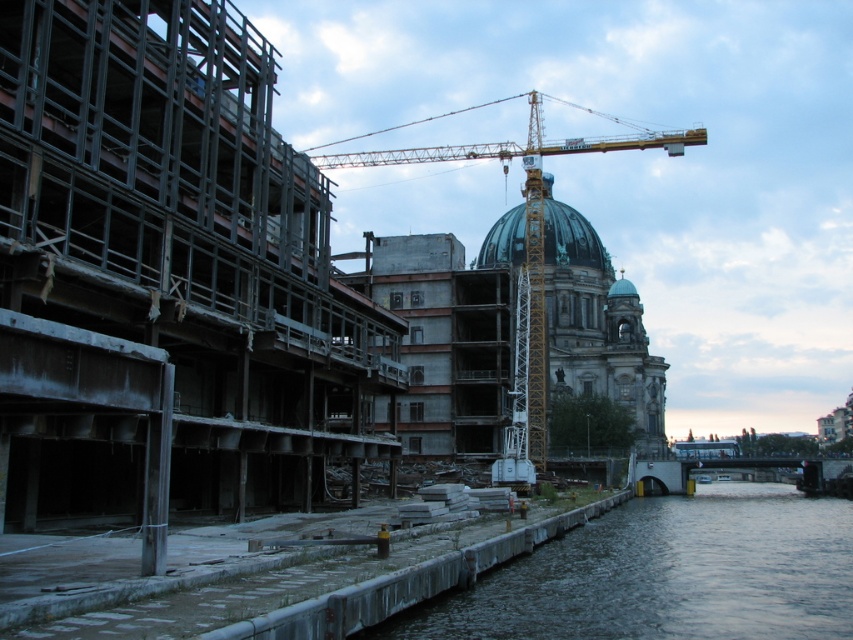
Between dark gray concrete at lower left and green glass dome at center, which one has more height?

green glass dome at center is taller.

The image size is (853, 640). What are the coordinates of `dark gray concrete at lower left` in the screenshot? It's located at (666, 573).

Between yellow metallic crane at center and green glass dome at center, which one has less height?

Standing shorter between the two is green glass dome at center.

Does point (608, 145) come farther from viewer compared to point (563, 218)?

No, it is not.

Between point (401, 150) and point (582, 244), which one is positioned behind?

Positioned behind is point (401, 150).

In order to click on yellow metallic crane at center in this screenshot , I will do `click(527, 218)`.

Between dark gray concrete at lower left and yellow metallic crane at center, which one has less height?

Standing shorter between the two is dark gray concrete at lower left.

In the scene shown: Can you confirm if dark gray concrete at lower left is positioned above yellow metallic crane at center?

No.

Is point (698, 561) farther from viewer compared to point (315, 157)?

That is False.

Locate an element on the screen. The width and height of the screenshot is (853, 640). dark gray concrete at lower left is located at coordinates (666, 573).